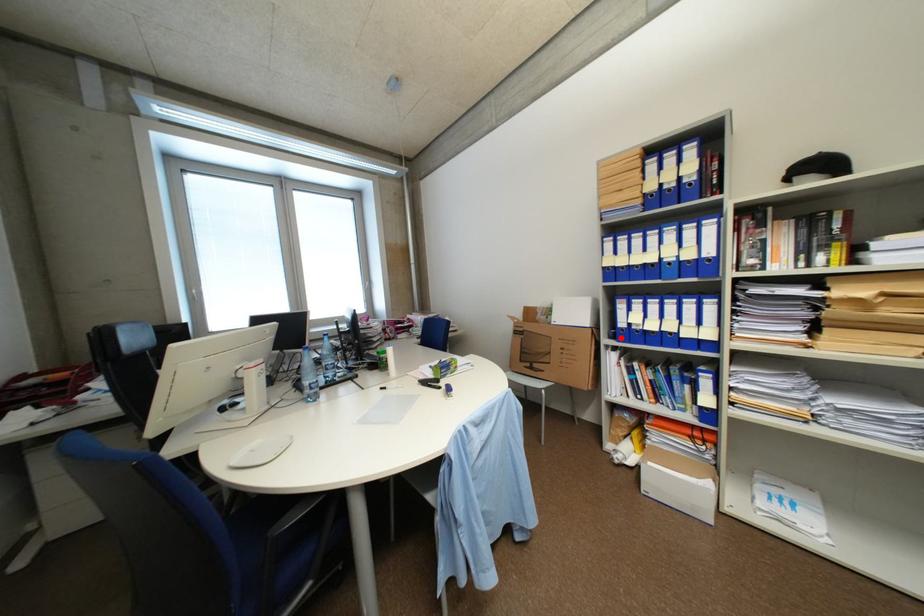
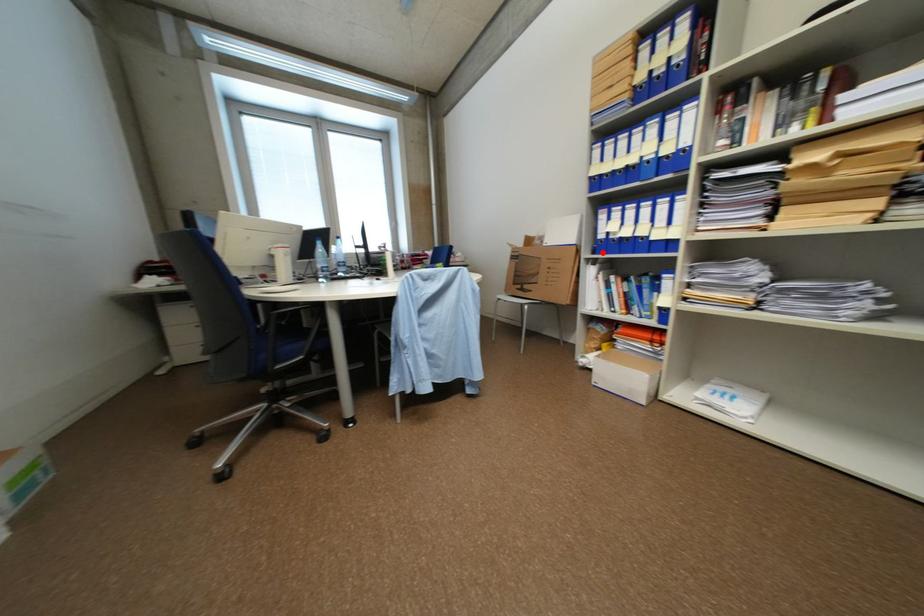
I am providing you with two images of the same scene from different viewpoints. A red point is marked on the first image and another point is marked on the second image. Is the marked point in image1 the same physical position as the marked point in image2?

Yes